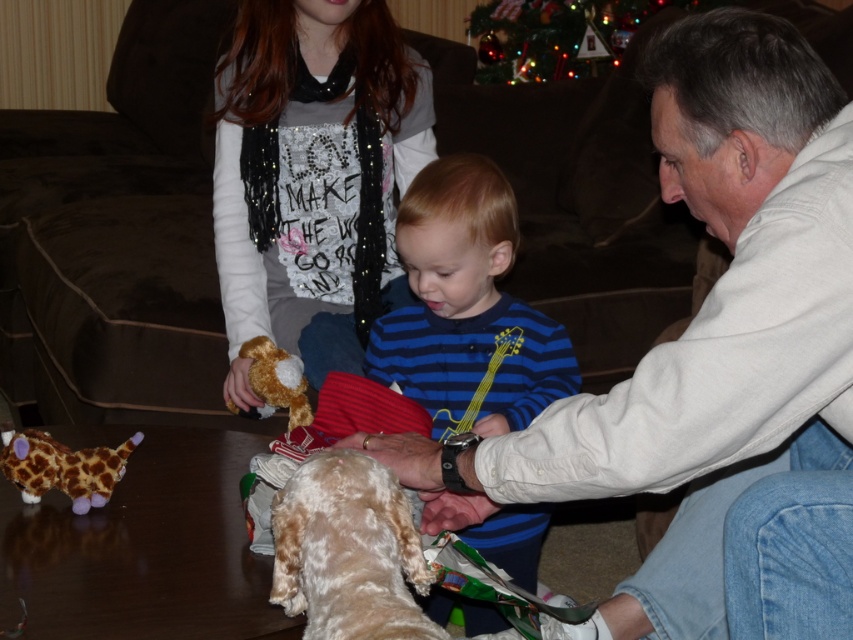
Question: Can you confirm if sparkly sequin shirt at upper center is smaller than blue striped shirt at center?

Choices:
 (A) yes
 (B) no

Answer: (A)

Question: Which point is closer to the camera taking this photo?

Choices:
 (A) (372, 460)
 (B) (558, 74)
 (C) (10, 472)
 (D) (515, 538)

Answer: (A)

Question: Does sparkly sequin shirt at upper center have a larger size compared to plush giraffe at lower left?

Choices:
 (A) no
 (B) yes

Answer: (B)

Question: Does white soft shirt at upper right have a larger size compared to fuzzy brown stuffed animal at center?

Choices:
 (A) no
 (B) yes

Answer: (B)

Question: Which point is farther from the camera taking this photo?

Choices:
 (A) (566, 44)
 (B) (718, 64)
 (C) (91, 454)
 (D) (274, 380)

Answer: (A)

Question: Which point appears farthest from the camera in this image?

Choices:
 (A) (242, 353)
 (B) (346, 509)

Answer: (A)